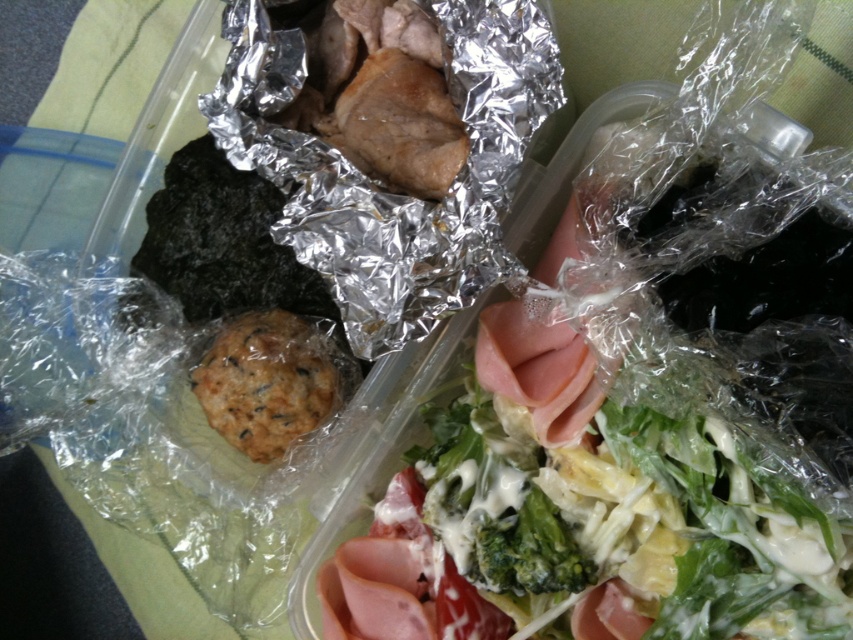
Question: Is green leafy salad at upper right smaller than green matte broccoli at center?

Choices:
 (A) yes
 (B) no

Answer: (B)

Question: From the image, what is the correct spatial relationship of green leafy salad at upper right in relation to green matte broccoli at center?

Choices:
 (A) left
 (B) right

Answer: (B)

Question: Which point is farther from the camera taking this photo?

Choices:
 (A) pos(488,524)
 (B) pos(635,394)

Answer: (A)

Question: Is green leafy salad at upper right smaller than green matte broccoli at center?

Choices:
 (A) no
 (B) yes

Answer: (A)